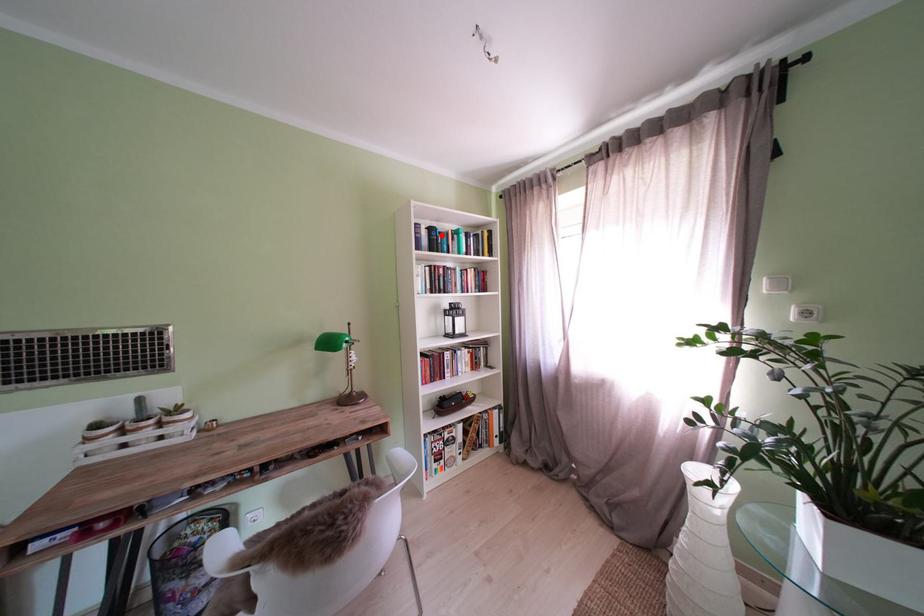
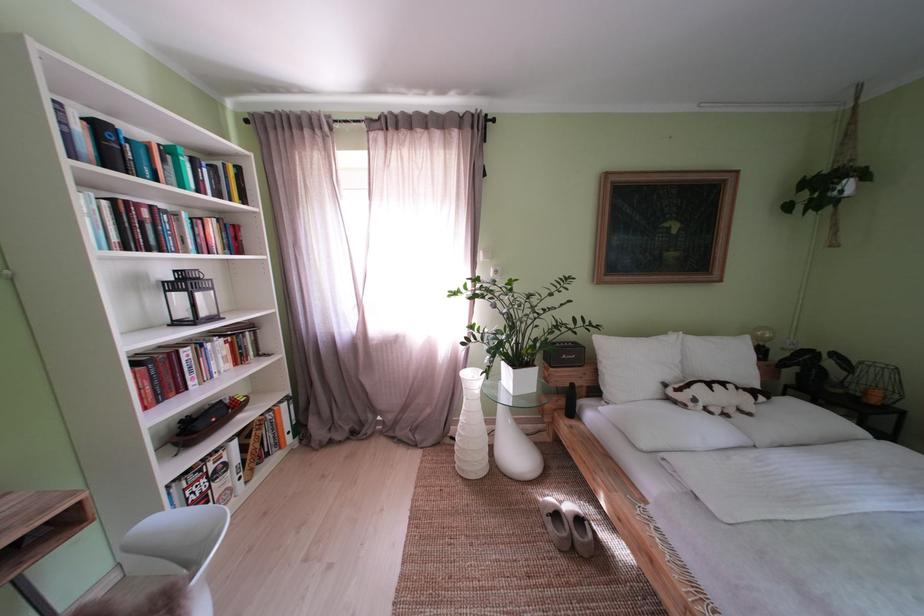
In the second image, find the point that corresponds to the highlighted location in the first image.

(111, 132)